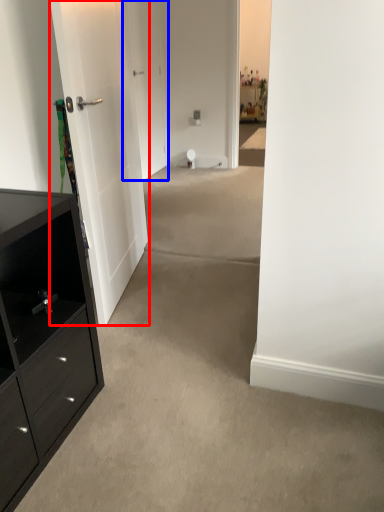
Question: Which of the following is the farthest to the observer, door (highlighted by a red box) or door (highlighted by a blue box)?

Choices:
 (A) door
 (B) door

Answer: (B)